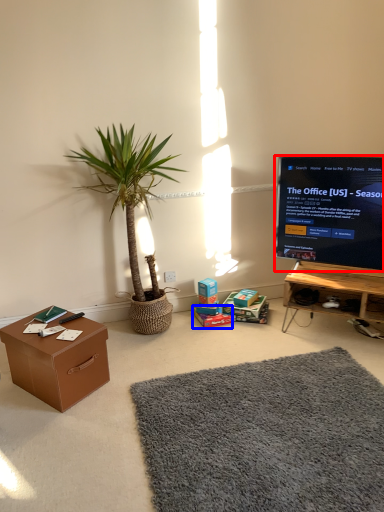
Question: Which point is further to the camera, television (highlighted by a red box) or cardboard box (highlighted by a blue box)?

Choices:
 (A) television
 (B) cardboard box

Answer: (B)